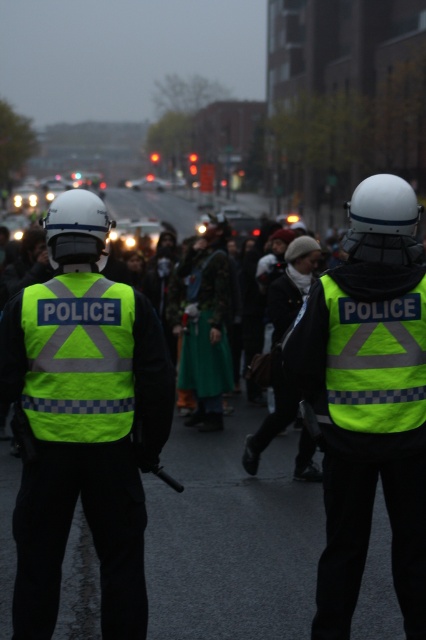
Question: Can you confirm if neon yellow reflective vest at center is smaller than high-visibility reflective vest at center?

Choices:
 (A) yes
 (B) no

Answer: (A)

Question: Does neon yellow reflective vest at center appear under high-visibility reflective vest at center?

Choices:
 (A) yes
 (B) no

Answer: (B)

Question: Which point is closer to the camera taking this photo?

Choices:
 (A) (397, 198)
 (B) (135, 364)

Answer: (B)

Question: Is neon yellow reflective vest at center bigger than high-visibility reflective vest at center?

Choices:
 (A) no
 (B) yes

Answer: (A)